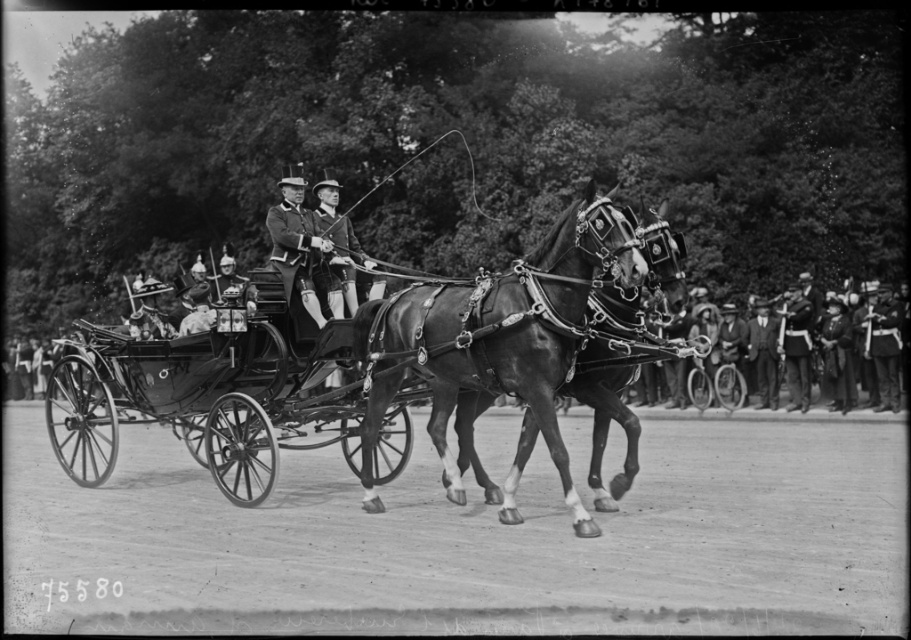
You are a photographer standing at the edge of the park where the historical scene is taking place. You want to take a photo of the shiny black horse at center and the smooth leather hat at center such that both are clearly visible in the frame. Given that your camera has a maximum focus range of 3 meters, will you be able to capture both objects in focus without moving closer?

The shiny black horse at center and smooth leather hat at center are 3.75 meters apart. Since the distance between them exceeds the camera focus range of 3 meters, you cannot capture both in focus simultaneously without moving closer.